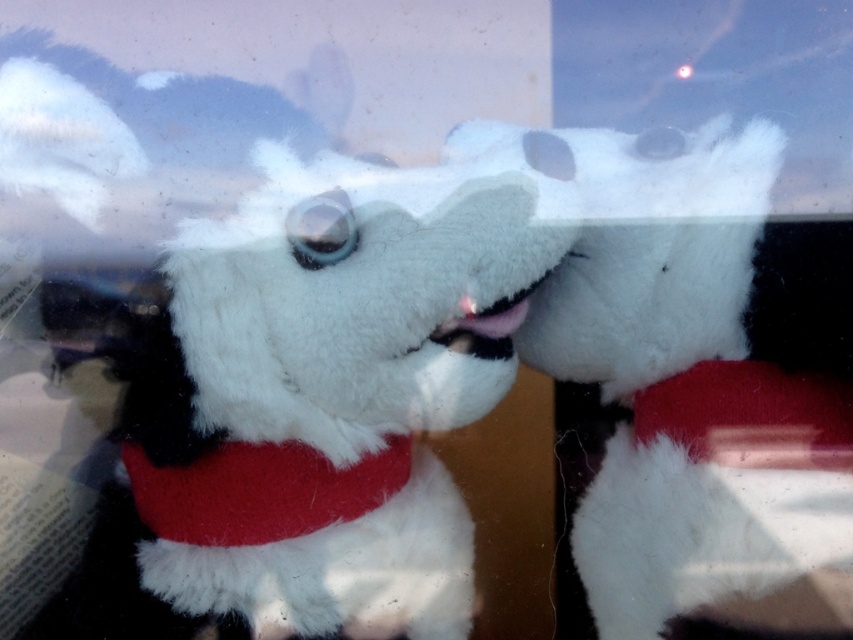
Consider the image. How distant is white plush dog at center from red plush neckband at center?

white plush dog at center is 9.98 inches from red plush neckband at center.

Is white plush dog at center above red plush neckband at center?

Yes, white plush dog at center is above red plush neckband at center.

Who is more distant from viewer, (758, 552) or (340, 493)?

The point (340, 493) is behind.

This screenshot has height=640, width=853. What are the coordinates of `white plush dog at center` in the screenshot? It's located at (689, 387).